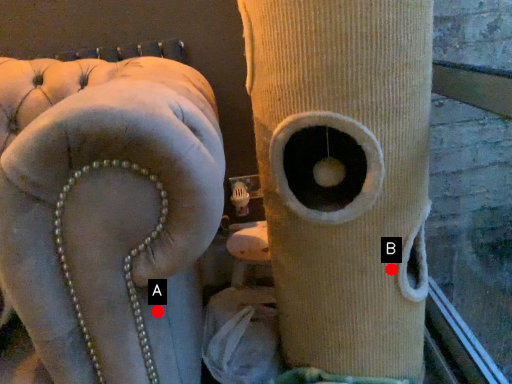
Question: Two points are circled on the image, labeled by A and B beside each circle. Which of the following is the farthest from the observer?

Choices:
 (A) A is further
 (B) B is further

Answer: (B)